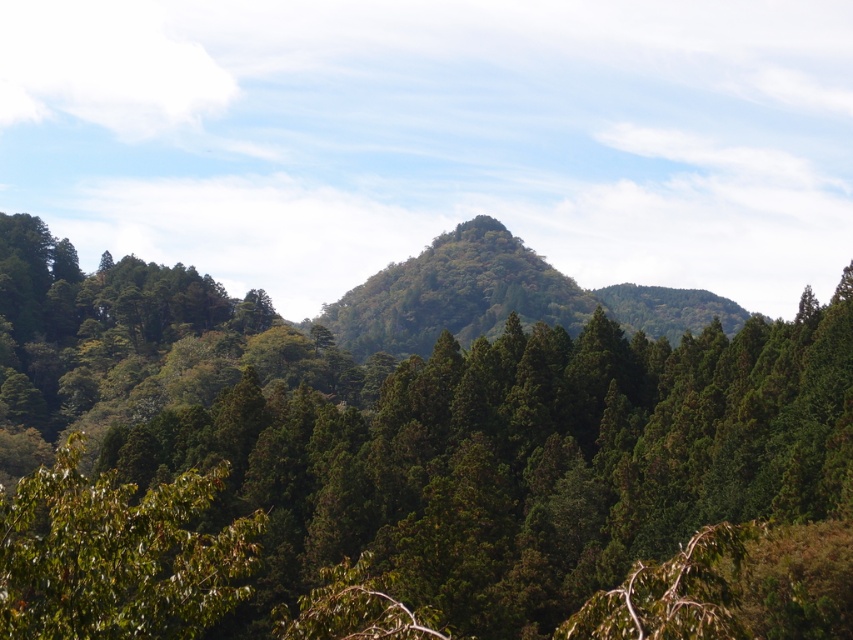
Question: Which point is closer to the camera?

Choices:
 (A) pyautogui.click(x=433, y=365)
 (B) pyautogui.click(x=33, y=632)
 (C) pyautogui.click(x=433, y=333)

Answer: (B)

Question: Does green matte tree at lower left have a smaller size compared to green textured hillside at center?

Choices:
 (A) yes
 (B) no

Answer: (A)

Question: Does green textured tree at center come behind green textured hillside at center?

Choices:
 (A) no
 (B) yes

Answer: (A)

Question: Can you confirm if green textured tree at center is positioned to the right of green matte tree at lower left?

Choices:
 (A) yes
 (B) no

Answer: (B)

Question: Which point is closer to the camera?

Choices:
 (A) green textured hillside at center
 (B) green matte tree at lower left
 (C) green textured tree at center

Answer: (B)

Question: Which point is farther to the camera?

Choices:
 (A) (595, 467)
 (B) (526, 317)

Answer: (B)